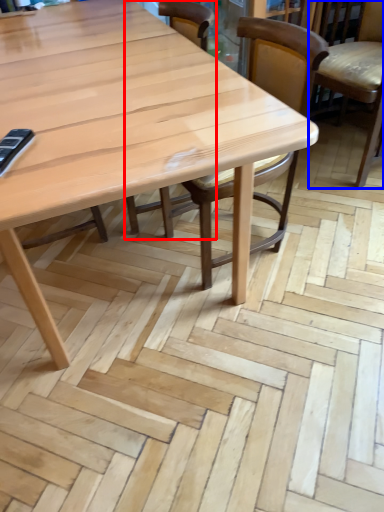
Question: Which point is closer to the camera, chair (highlighted by a red box) or chair (highlighted by a blue box)?

Choices:
 (A) chair
 (B) chair

Answer: (A)